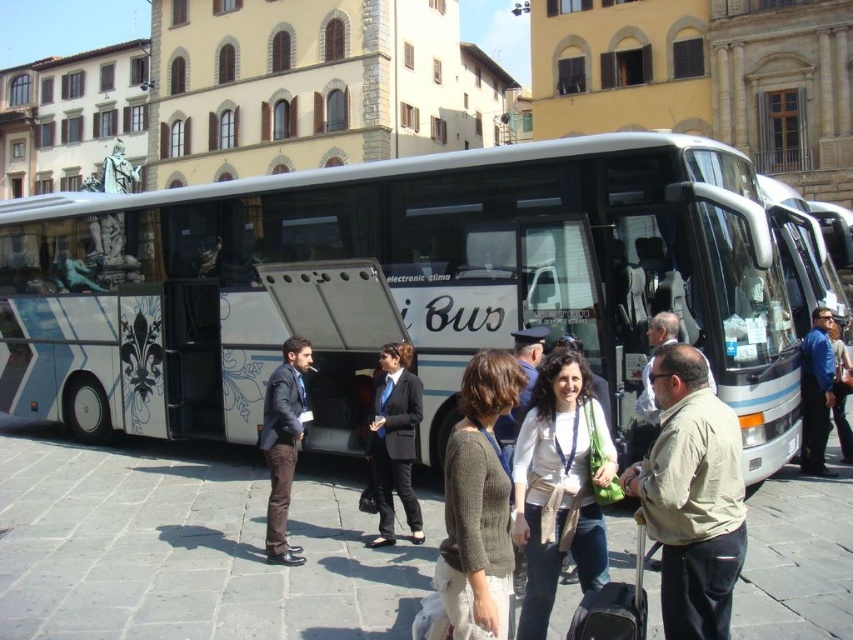
Question: Which object appears closest to the camera in this image?

Choices:
 (A) dark gray suit at center
 (B) beige fabric shirt at center
 (C) metallic silver bus stop at center

Answer: (B)

Question: Which of the following is the closest to the observer?

Choices:
 (A) dark gray suit at center
 (B) metallic silver bus stop at center

Answer: (A)

Question: Is beige fabric shirt at center thinner than knit sweater at center?

Choices:
 (A) no
 (B) yes

Answer: (A)

Question: Is metallic silver bus stop at center smaller than dark gray suit at center?

Choices:
 (A) yes
 (B) no

Answer: (B)

Question: Does beige fabric shirt at center come behind knit sweater at center?

Choices:
 (A) no
 (B) yes

Answer: (A)

Question: Which is nearer to the knit sweater at center?

Choices:
 (A) white cotton shirt at center
 (B) blue denim jacket at center

Answer: (A)